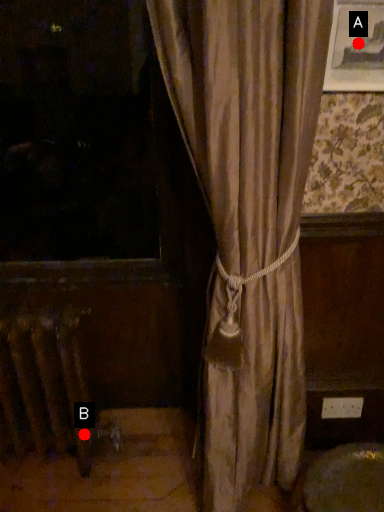
Question: Two points are circled on the image, labeled by A and B beside each circle. Which point is closer to the camera taking this photo?

Choices:
 (A) A is closer
 (B) B is closer

Answer: (A)